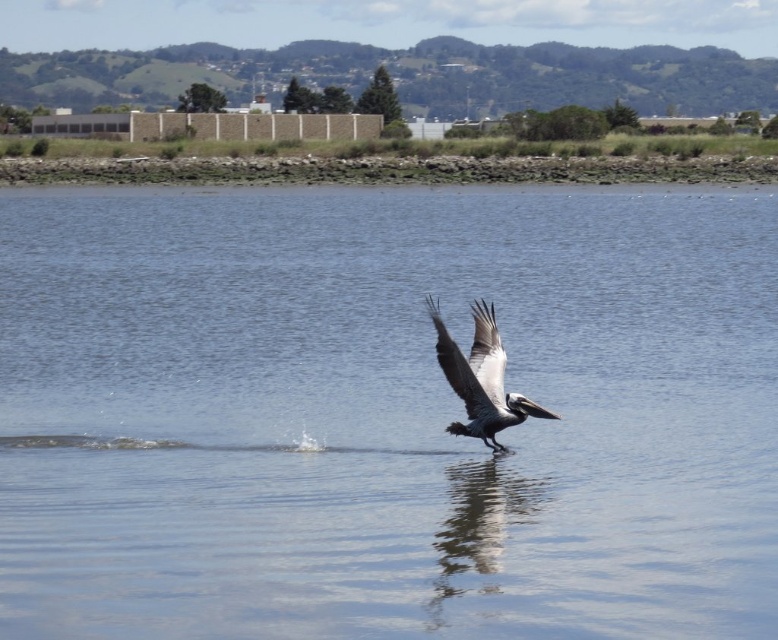
Question: Which object is the closest to the white feathered wing at center?

Choices:
 (A) clear water at center
 (B) gray feathered wing at center

Answer: (B)

Question: Which point is farther to the camera?

Choices:
 (A) (468, 365)
 (B) (654, 397)
 (C) (489, 339)

Answer: (B)

Question: Is brown feathered pelican at center bigger than gray feathered wing at center?

Choices:
 (A) no
 (B) yes

Answer: (B)

Question: Is clear water at center thinner than brown feathered pelican at center?

Choices:
 (A) no
 (B) yes

Answer: (A)

Question: Among these points, which one is farthest from the camera?

Choices:
 (A) (82, 241)
 (B) (479, 301)
 (C) (478, 413)
 (D) (500, 362)

Answer: (A)

Question: Can you confirm if brown feathered pelican at center is thinner than gray feathered wing at center?

Choices:
 (A) no
 (B) yes

Answer: (A)